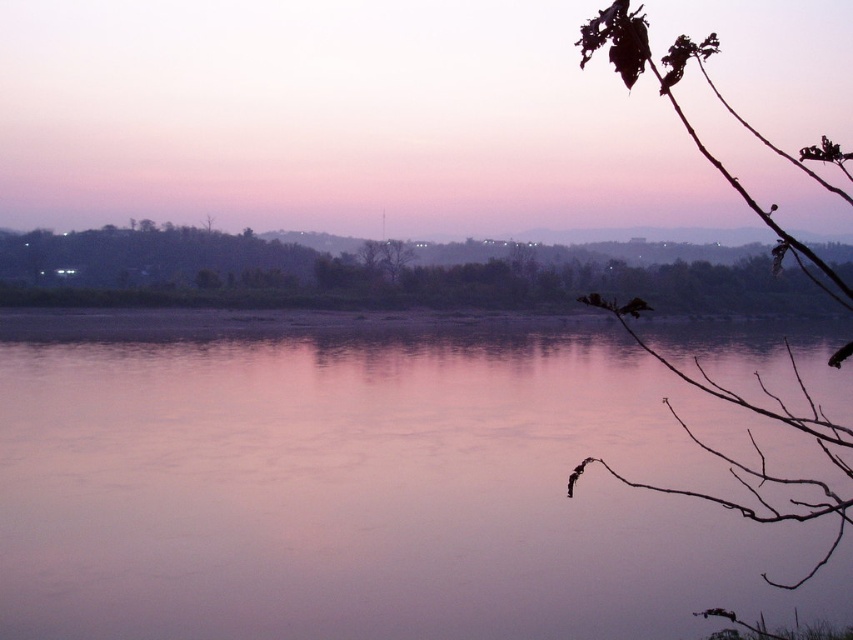
Question: Among these points, which one is nearest to the camera?

Choices:
 (A) (399, 268)
 (B) (490, 38)

Answer: (A)

Question: Can you confirm if green leafy tree at upper center is wider than brown/dry branches at upper right?

Choices:
 (A) yes
 (B) no

Answer: (A)

Question: Which point is closer to the camera?

Choices:
 (A) brown/dry branches at upper right
 (B) smooth water at center
 (C) pink matte sky at upper center

Answer: (A)

Question: Can you confirm if pink matte sky at upper center is bigger than brown/dry branches at upper right?

Choices:
 (A) yes
 (B) no

Answer: (B)

Question: Is smooth water at center wider than pink matte sky at upper center?

Choices:
 (A) yes
 (B) no

Answer: (B)

Question: Which of the following is the farthest from the observer?

Choices:
 (A) pink matte sky at upper center
 (B) brown/dry branches at upper right
 (C) green leafy tree at upper center

Answer: (A)